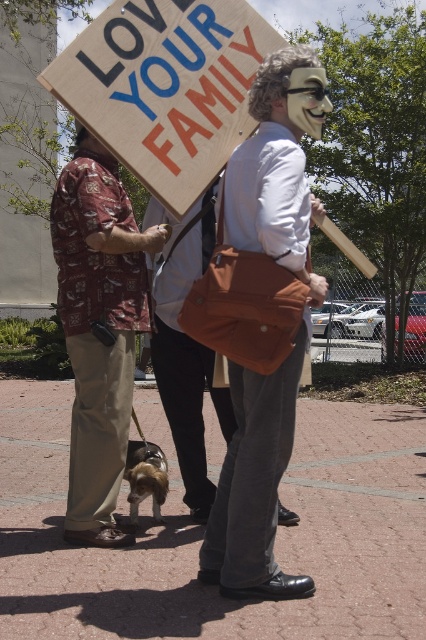
Question: Is matte brown bag at center to the right of printed fabric shirt at left from the viewer's perspective?

Choices:
 (A) yes
 (B) no

Answer: (A)

Question: Can you confirm if wooden sign at upper center is thinner than printed fabric shirt at left?

Choices:
 (A) no
 (B) yes

Answer: (A)

Question: Which point is farther from the camera taking this photo?

Choices:
 (A) (95, 470)
 (B) (267, 378)
 (C) (201, 70)

Answer: (A)

Question: Among these points, which one is farthest from the camera?

Choices:
 (A) (40, 77)
 (B) (92, 486)
 (C) (256, 88)

Answer: (B)

Question: Does wooden sign at upper center have a lesser width compared to matte brown bag at center?

Choices:
 (A) yes
 (B) no

Answer: (B)

Question: Which of the following is the closest to the observer?

Choices:
 (A) (169, 28)
 (B) (253, 173)

Answer: (B)